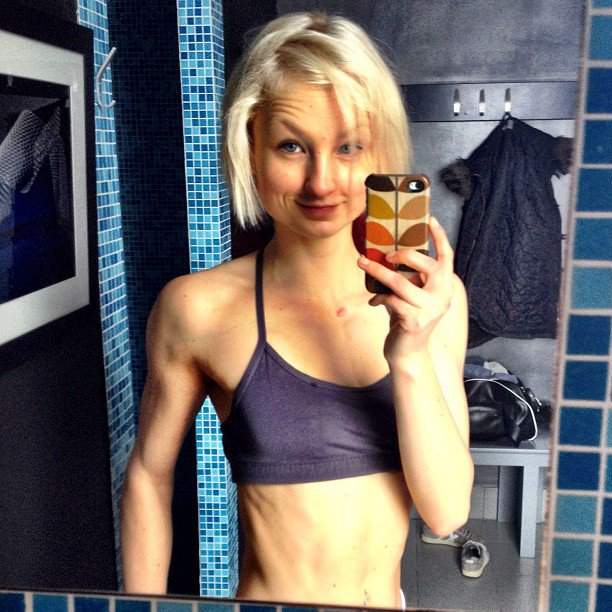
The width and height of the screenshot is (612, 612). What are the coordinates of `mirror` in the screenshot? It's located at (37, 469).